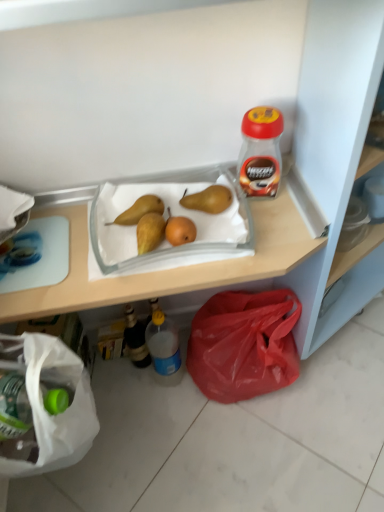
This screenshot has height=512, width=384. Identify the location of brown matte pear at center, positioned as the 1th pear in right-to-left order. (208, 199).

This screenshot has width=384, height=512. What do you see at coordinates (136, 339) in the screenshot? I see `translucent glass bottle at lower left, which is the 2th bottle in bottom-to-top order` at bounding box center [136, 339].

This screenshot has width=384, height=512. What do you see at coordinates (260, 152) in the screenshot? I see `red plastic jar at upper right, arranged as the 3th bottle when viewed from the left` at bounding box center [260, 152].

The width and height of the screenshot is (384, 512). I want to click on yellow matte pear at center, arranged as the first pear when viewed from the left, so click(x=139, y=210).

What do you see at coordinates (139, 210) in the screenshot?
I see `yellow matte pear at center, which ranks as the second pear in right-to-left order` at bounding box center [139, 210].

The width and height of the screenshot is (384, 512). What do you see at coordinates (244, 344) in the screenshot? I see `red plastic bag at lower right` at bounding box center [244, 344].

Where is `brown matte pear at center, arranged as the second pear when viewed from the left`? This screenshot has width=384, height=512. brown matte pear at center, arranged as the second pear when viewed from the left is located at coordinates (208, 199).

Consider the image. Is translucent plastic bottle at lower center, which ranks as the 1th bottle in bottom-to-top order, next to brown matte pear at center, arranged as the second pear when viewed from the left, and touching it?

translucent plastic bottle at lower center, which ranks as the 1th bottle in bottom-to-top order, and brown matte pear at center, arranged as the second pear when viewed from the left, are not in contact.

From the image's perspective, between translucent plastic bottle at lower center, which is counted as the second bottle, starting from the left, and brown matte pear at center, positioned as the 1th pear in right-to-left order, who is located below?

translucent plastic bottle at lower center, which is counted as the second bottle, starting from the left, from the image's perspective.

Considering the sizes of objects translucent plastic bottle at lower center, which is counted as the second bottle, starting from the left, and brown matte pear at center, positioned as the 1th pear in right-to-left order, in the image provided, who is wider, translucent plastic bottle at lower center, which is counted as the second bottle, starting from the left, or brown matte pear at center, positioned as the 1th pear in right-to-left order,?

Result: brown matte pear at center, positioned as the 1th pear in right-to-left order.

From a real-world perspective, relative to brown matte pear at center, arranged as the second pear when viewed from the left, is translucent plastic bottle at lower center, which ranks as the 1th bottle in bottom-to-top order, vertically above or below?

translucent plastic bottle at lower center, which ranks as the 1th bottle in bottom-to-top order, is below brown matte pear at center, arranged as the second pear when viewed from the left.

Is translucent plastic bottle at lower center, which ranks as the 1th bottle in bottom-to-top order, to the right of translucent plastic tray at upper center from the viewer's perspective?

No, translucent plastic bottle at lower center, which ranks as the 1th bottle in bottom-to-top order, is not to the right of translucent plastic tray at upper center.

How far apart are translucent plastic bottle at lower center, the 2th bottle positioned from the right, and translucent plastic tray at upper center?

translucent plastic bottle at lower center, the 2th bottle positioned from the right, is 21.04 inches from translucent plastic tray at upper center.

Between translucent plastic bottle at lower center, the 2th bottle positioned from the right, and translucent plastic tray at upper center, which one has less height?

With less height is translucent plastic bottle at lower center, the 2th bottle positioned from the right.

There is a translucent plastic tray at upper center. Identify the location of the 1st bottle below it (from a real-world perspective). Image resolution: width=384 pixels, height=512 pixels. (164, 349).

Is red plastic bag at lower right further to camera compared to yellow matte pear at center, arranged as the first pear when viewed from the left?

Yes, it is behind yellow matte pear at center, arranged as the first pear when viewed from the left.

Is point (264, 348) in front of point (160, 213)?

That is False.

Which of these two, red plastic bag at lower right or yellow matte pear at center, which ranks as the second pear in right-to-left order, stands shorter?

yellow matte pear at center, which ranks as the second pear in right-to-left order, is shorter.

From a real-world perspective, who is located higher, red plastic bag at lower right or yellow matte pear at center, arranged as the first pear when viewed from the left?

From a 3D spatial view, yellow matte pear at center, arranged as the first pear when viewed from the left, is above.

Is brown matte pear at center, positioned as the 1th pear in right-to-left order, bigger or smaller than red plastic bag at lower right?

Considering their sizes, brown matte pear at center, positioned as the 1th pear in right-to-left order, takes up less space than red plastic bag at lower right.

From the image's perspective, which one is positioned higher, brown matte pear at center, arranged as the second pear when viewed from the left, or red plastic bag at lower right?

brown matte pear at center, arranged as the second pear when viewed from the left.

Can you tell me how much brown matte pear at center, positioned as the 1th pear in right-to-left order, and red plastic bag at lower right differ in facing direction?

They differ by 74.4 degrees in their facing directions.

Is brown matte pear at center, positioned as the 1th pear in right-to-left order, at the right side of red plastic bag at lower right?

No.

Where is `bottle behind the translucent plastic bottle at lower center, the 2th bottle positioned from the right`? The image size is (384, 512). bottle behind the translucent plastic bottle at lower center, the 2th bottle positioned from the right is located at coordinates (136, 339).

Considering the positions of objects translucent plastic bottle at lower center, which is counted as the second bottle, starting from the left, and translucent glass bottle at lower left, marked as the 3th bottle in a right-to-left arrangement, in the image provided, who is more to the right, translucent plastic bottle at lower center, which is counted as the second bottle, starting from the left, or translucent glass bottle at lower left, marked as the 3th bottle in a right-to-left arrangement,?

translucent plastic bottle at lower center, which is counted as the second bottle, starting from the left.

Which is behind, translucent plastic bottle at lower center, the 2th bottle positioned from the right, or translucent glass bottle at lower left, the 2th bottle viewed from the top?

translucent glass bottle at lower left, the 2th bottle viewed from the top, is further from the camera.

From the picture: Is translucent plastic bottle at lower center, the 2th bottle positioned from the right, with translucent glass bottle at lower left, the 2th bottle viewed from the top?

Absolutely, translucent plastic bottle at lower center, the 2th bottle positioned from the right, is next to and touching translucent glass bottle at lower left, the 2th bottle viewed from the top.

Considering the sizes of objects translucent plastic tray at upper center and red plastic jar at upper right, which is counted as the first bottle, starting from the right, in the image provided, who is bigger, translucent plastic tray at upper center or red plastic jar at upper right, which is counted as the first bottle, starting from the right,?

translucent plastic tray at upper center.

Which is nearer, (318, 39) or (270, 108)?

Positioned in front is point (318, 39).

Considering the relative sizes of translucent plastic tray at upper center and red plastic jar at upper right, arranged as the 3th bottle when viewed from the left, in the image provided, is translucent plastic tray at upper center wider than red plastic jar at upper right, arranged as the 3th bottle when viewed from the left,?

Yes, translucent plastic tray at upper center is wider than red plastic jar at upper right, arranged as the 3th bottle when viewed from the left.

Is red plastic bag at lower right positioned beyond the bounds of translucent plastic bottle at lower center, which is counted as the second bottle, starting from the left?

Yes, red plastic bag at lower right is outside of translucent plastic bottle at lower center, which is counted as the second bottle, starting from the left.

Is red plastic bag at lower right closer to camera compared to translucent plastic bottle at lower center, which is counted as the second bottle, starting from the left?

Yes, it is.

Between red plastic bag at lower right and translucent plastic bottle at lower center, which ranks as the 1th bottle in bottom-to-top order, which one has less height?

red plastic bag at lower right is shorter.

The width and height of the screenshot is (384, 512). Find the location of `pear that is on the right side of translucent plastic bottle at lower center, which is counted as the second bottle, starting from the left`. pear that is on the right side of translucent plastic bottle at lower center, which is counted as the second bottle, starting from the left is located at coordinates (208, 199).

Image resolution: width=384 pixels, height=512 pixels. Identify the location of the 1st bottle positioned below the translucent plastic tray at upper center (from a real-world perspective). (164, 349).

Based on their spatial positions, is translucent plastic bottle at lower center, which is counted as the second bottle, starting from the left, or translucent glass bottle at lower left, which is counted as the 1th bottle, starting from the left, closer to translucent plastic tray at upper center?

translucent plastic bottle at lower center, which is counted as the second bottle, starting from the left.

When comparing their distances from translucent glass bottle at lower left, which is counted as the 1th bottle, starting from the left, does translucent plastic bottle at lower center, which is counted as the second bottle, starting from the left, or red plastic jar at upper right, which is the first bottle in top-to-bottom order, seem further?

red plastic jar at upper right, which is the first bottle in top-to-bottom order, is positioned further to the anchor translucent glass bottle at lower left, which is counted as the 1th bottle, starting from the left.

Based on their spatial positions, is translucent plastic bottle at lower center, marked as the third bottle in a top-to-bottom arrangement, or red plastic bag at lower right closer to translucent glass bottle at lower left, the 2th bottle viewed from the top?

translucent plastic bottle at lower center, marked as the third bottle in a top-to-bottom arrangement, lies closer to translucent glass bottle at lower left, the 2th bottle viewed from the top, than the other object.

Estimate the real-world distances between objects in this image. Which object is further from red plastic jar at upper right, which is the first bottle in top-to-bottom order, red plastic bag at lower right or brown matte pear at center, arranged as the second pear when viewed from the left?

red plastic bag at lower right is further to red plastic jar at upper right, which is the first bottle in top-to-bottom order.

Looking at this image, considering their positions, is red plastic jar at upper right, which is the first bottle in top-to-bottom order, positioned further to yellow matte pear at center, which ranks as the second pear in right-to-left order, than brown matte pear at center, positioned as the 1th pear in right-to-left order?

Among the two, red plastic jar at upper right, which is the first bottle in top-to-bottom order, is located further to yellow matte pear at center, which ranks as the second pear in right-to-left order.

Looking at the image, which one is located closer to red plastic bag at lower right, brown matte pear at center, arranged as the second pear when viewed from the left, or translucent plastic bottle at lower center, marked as the third bottle in a top-to-bottom arrangement?

translucent plastic bottle at lower center, marked as the third bottle in a top-to-bottom arrangement, is positioned closer to the anchor red plastic bag at lower right.

Based on their spatial positions, is red plastic jar at upper right, which is the first bottle in top-to-bottom order, or translucent glass bottle at lower left, which is the 2th bottle in bottom-to-top order, further from red plastic bag at lower right?

red plastic jar at upper right, which is the first bottle in top-to-bottom order, is positioned further to the anchor red plastic bag at lower right.

From the picture: Looking at the image, which one is located closer to translucent plastic tray at upper center, translucent glass bottle at lower left, which is the 2th bottle in bottom-to-top order, or red plastic bag at lower right?

Based on the image, red plastic bag at lower right appears to be nearer to translucent plastic tray at upper center.

In order to click on bottle between yellow matte pear at center, arranged as the first pear when viewed from the left, and translucent plastic bottle at lower center, marked as the third bottle in a top-to-bottom arrangement, from top to bottom in this screenshot , I will do `click(136, 339)`.

Locate an element on the screen. Image resolution: width=384 pixels, height=512 pixels. plastic bag between translucent plastic tray at upper center and translucent glass bottle at lower left, marked as the 3th bottle in a right-to-left arrangement, from front to back is located at coordinates (244, 344).

You are a GUI agent. You are given a task and a screenshot of the screen. Output one action in this format:
    pyautogui.click(x=<x>, y=<y>)
    Task: Click on the pear between brown matte pear at center, positioned as the 1th pear in right-to-left order, and red plastic bag at lower right vertically
    The width and height of the screenshot is (384, 512).
    Given the screenshot: What is the action you would take?
    pos(139,210)

Find the location of `bottle between translucent plastic tray at upper center and yellow matte pear at center, arranged as the first pear when viewed from the left, from front to back`. bottle between translucent plastic tray at upper center and yellow matte pear at center, arranged as the first pear when viewed from the left, from front to back is located at coordinates (260, 152).